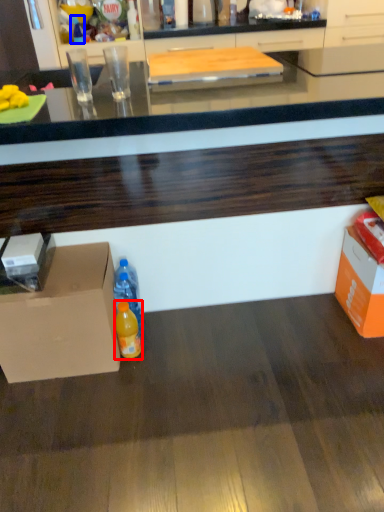
Question: Which point is closer to the camera, bottle (highlighted by a red box) or bottle (highlighted by a blue box)?

Choices:
 (A) bottle
 (B) bottle

Answer: (A)